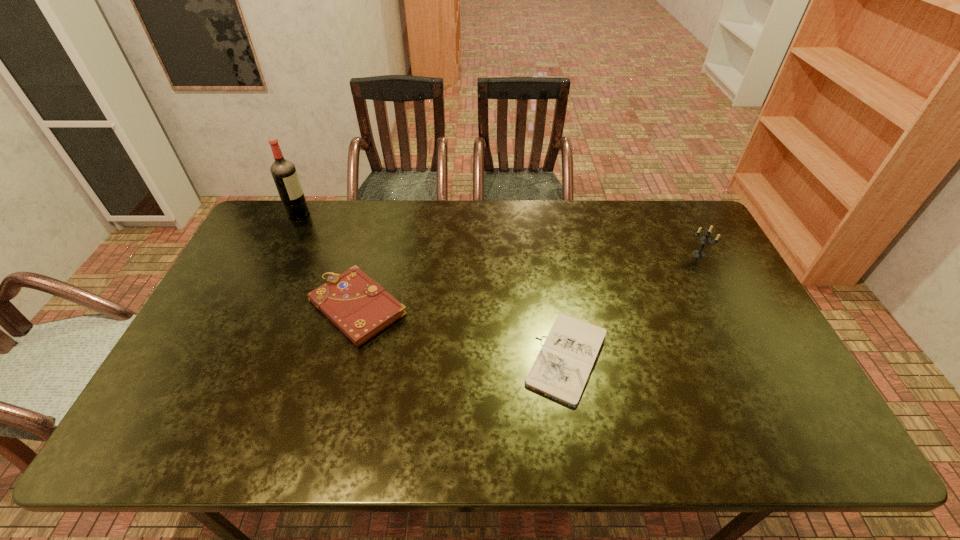
Identify the location of empty location between the right notebook and the leftmost object. (433, 286).

Locate which object is the second closest to the third nearest object. Please provide its 2D coordinates. Your answer should be formatted as a tuple, i.e. [(x, y)], where the tuple contains the x and y coordinates of a point satisfying the conditions above.

[(358, 306)]

This screenshot has width=960, height=540. I want to click on the third closest object relative to the rightmost object, so click(x=284, y=173).

Locate an element on the screen. The image size is (960, 540). free space in the image that satisfies the following two spatial constraints: 1. on the front-facing side of the farthest object; 2. on the left side of the third shortest object is located at coordinates (278, 254).

At what (x,y) coordinates should I click in order to perform the action: click on free point that satisfies the following two spatial constraints: 1. on the back side of the taller notebook; 2. on the right side of the third shortest object. Please return your answer as a coordinate pair (x, y). This screenshot has height=540, width=960. Looking at the image, I should click on (372, 254).

At what (x,y) coordinates should I click in order to perform the action: click on free region that satisfies the following two spatial constraints: 1. on the front side of the right notebook; 2. on the right side of the left notebook. Please return your answer as a coordinate pair (x, y). Looking at the image, I should click on (345, 360).

Image resolution: width=960 pixels, height=540 pixels. I want to click on vacant area that satisfies the following two spatial constraints: 1. on the front-facing side of the farthest object; 2. on the left side of the third tallest object, so click(253, 307).

Where is `vacant region that satisfies the following two spatial constraints: 1. on the front side of the left notebook; 2. on the right side of the right notebook`? vacant region that satisfies the following two spatial constraints: 1. on the front side of the left notebook; 2. on the right side of the right notebook is located at coordinates (345, 360).

Locate an element on the screen. The height and width of the screenshot is (540, 960). free point that satisfies the following two spatial constraints: 1. on the front-facing side of the second farthest object; 2. on the right side of the liquor is located at coordinates (278, 254).